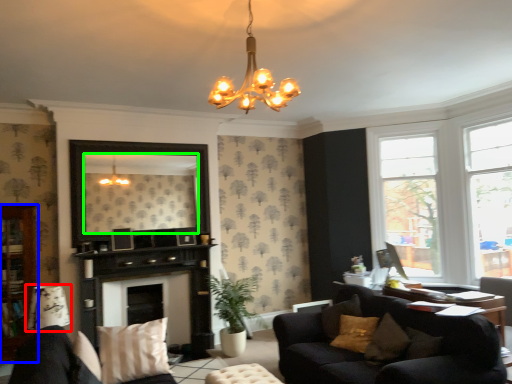
Question: Considering the real-world distances, which object is closest to lamp (highlighted by a red box)? cabinetry (highlighted by a blue box) or mirror (highlighted by a green box).

Choices:
 (A) cabinetry
 (B) mirror

Answer: (A)